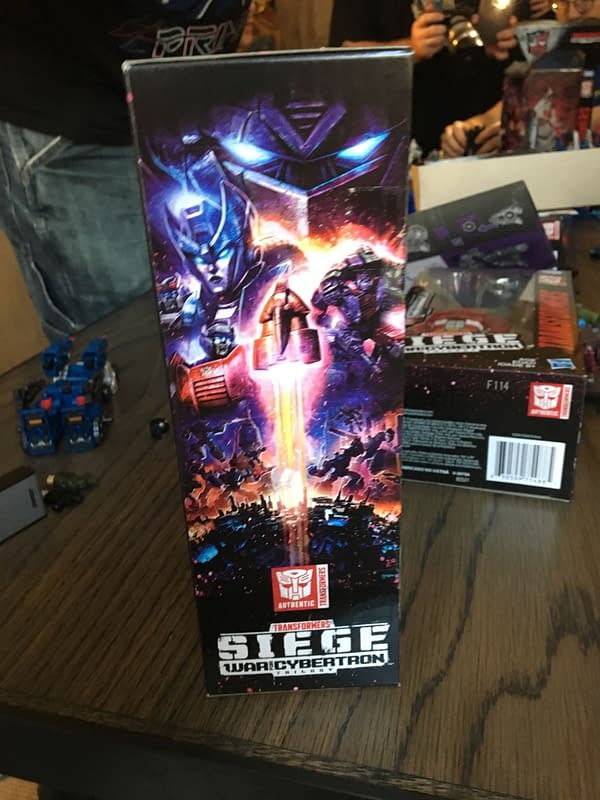
The image size is (600, 800). I want to click on robot figurine, so click(x=82, y=368).